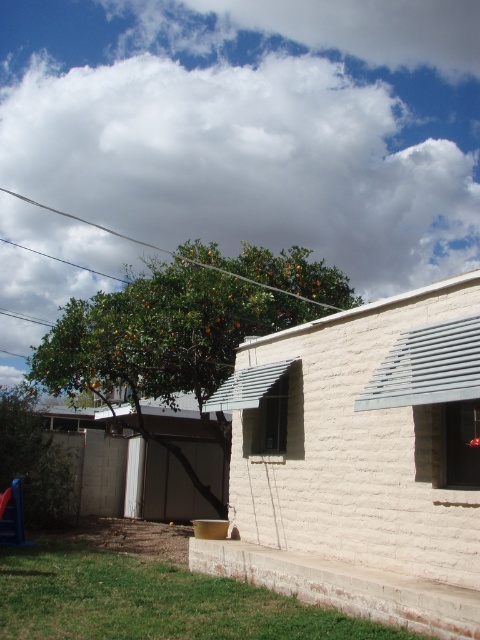
Question: Among these points, which one is nearest to the camera?

Choices:
 (A) (261, 429)
 (B) (184, 305)

Answer: (A)

Question: From the image, what is the correct spatial relationship of green leafy tree at center in relation to transparent glass window at lower right?

Choices:
 (A) left
 (B) right

Answer: (A)

Question: Observing the image, what is the correct spatial positioning of green leafy tree at center in reference to clear glass window at center?

Choices:
 (A) left
 (B) right

Answer: (A)

Question: Does white stucco shed at lower right have a greater width compared to green leafy tree at center?

Choices:
 (A) yes
 (B) no

Answer: (B)

Question: Which point is closer to the camera?

Choices:
 (A) transparent glass window at lower right
 (B) clear glass window at center
 (C) green leafy tree at center

Answer: (A)

Question: Which point is closer to the camera?

Choices:
 (A) coord(276,433)
 (B) coord(474,400)

Answer: (B)